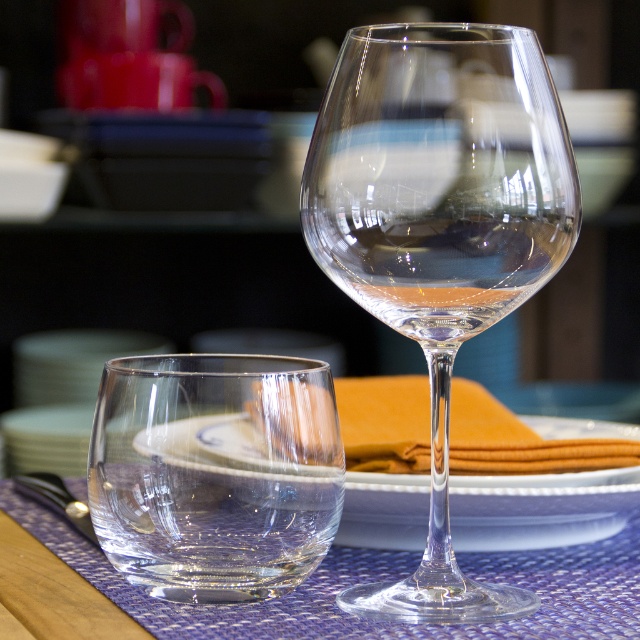
Question: From the image, what is the correct spatial relationship of transparent glass at lower left in relation to polished silver fork at lower left?

Choices:
 (A) below
 (B) above

Answer: (B)

Question: Among these points, which one is nearest to the camera?

Choices:
 (A) (461, 282)
 (B) (106, 563)

Answer: (A)

Question: Can you confirm if blue woven placemat at center is wider than polished silver fork at lower left?

Choices:
 (A) yes
 (B) no

Answer: (A)

Question: Which of these objects is positioned closest to the transparent glass wine glass at center?

Choices:
 (A) white glossy plate at center
 (B) transparent glass at lower left
 (C) transparent glass wine at center

Answer: (C)

Question: Is blue woven placemat at center smaller than polished silver fork at lower left?

Choices:
 (A) yes
 (B) no

Answer: (B)

Question: Which object appears farthest from the camera in this image?

Choices:
 (A) transparent glass at lower left
 (B) white glossy plate at center
 (C) blue woven placemat at center
 (D) transparent glass wine glass at center

Answer: (C)